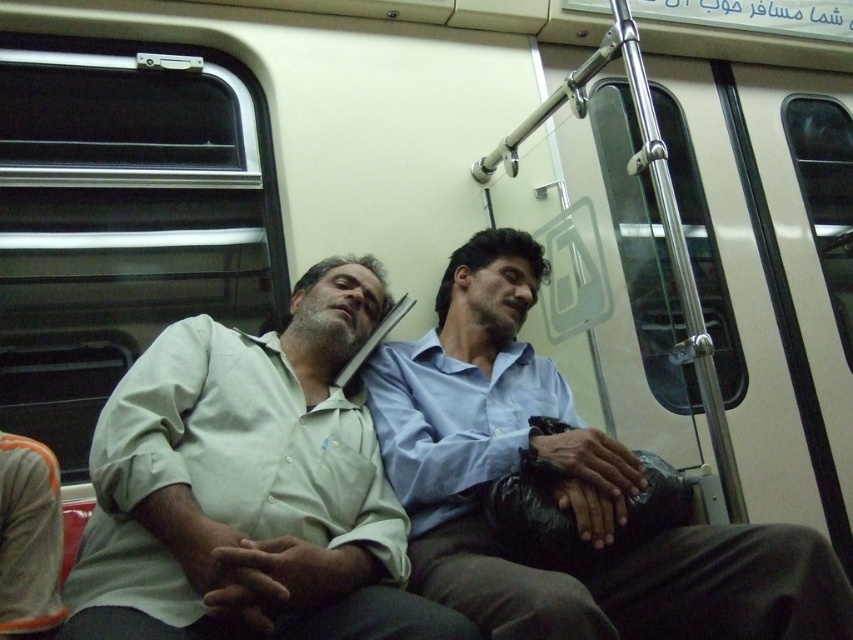
Does point (370, 320) lie in front of point (573, 518)?

No, (370, 320) is behind (573, 518).

Which is behind, point (148, 580) or point (561, 404)?

Positioned behind is point (561, 404).

This screenshot has height=640, width=853. I want to click on light green cotton shirt at center, so click(248, 486).